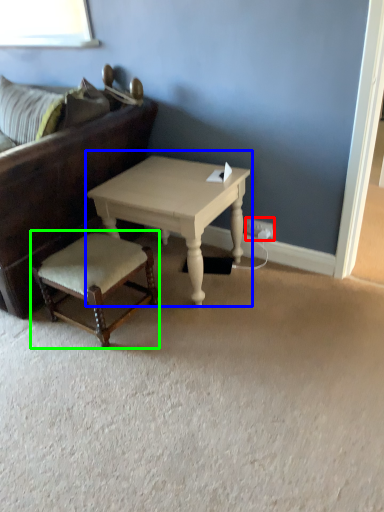
Question: Considering the real-world distances, which object is closest to electric outlet (highlighted by a red box)? coffee table (highlighted by a blue box) or stool (highlighted by a green box).

Choices:
 (A) coffee table
 (B) stool

Answer: (A)